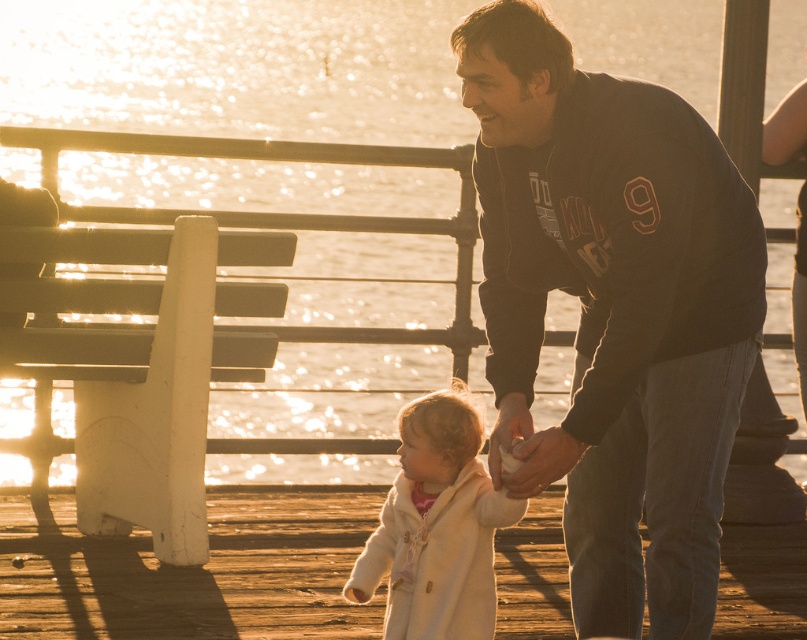
Is dark gray hoodie at center wider than white fleece coat at center?

Correct, the width of dark gray hoodie at center exceeds that of white fleece coat at center.

Between dark gray hoodie at center and white fleece coat at center, which one has less height?

With less height is white fleece coat at center.

Who is more forward, (746, 310) or (450, 451)?

Positioned in front is point (746, 310).

The image size is (807, 640). What are the coordinates of `dark gray hoodie at center` in the screenshot? It's located at (613, 310).